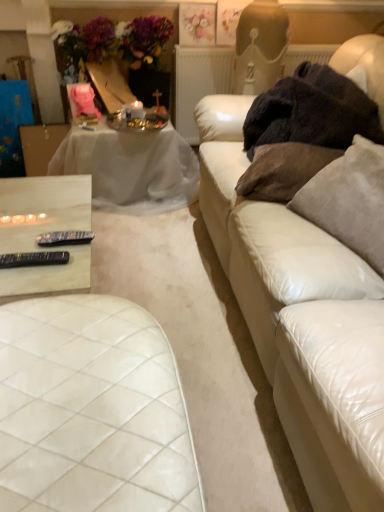
Image resolution: width=384 pixels, height=512 pixels. Identify the location of free space in front of black plastic remote control at lower left, the 2th tableware in the back-to-front sequence. (26, 284).